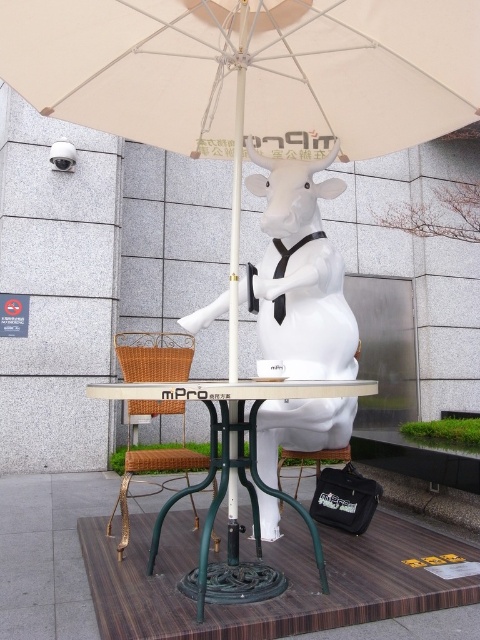
Between white glossy statue at center and green metal table at center, which one appears on the left side from the viewer's perspective?

Positioned to the left is green metal table at center.

Looking at this image, is white glossy statue at center taller than green metal table at center?

Indeed, white glossy statue at center has a greater height compared to green metal table at center.

At what (x,y) coordinates should I click in order to perform the action: click on white glossy statue at center. Please return your answer as a coordinate pair (x, y). The width and height of the screenshot is (480, 640). Looking at the image, I should click on (301, 273).

Which of these two, green metal table at center or woven rattan stool at lower center, stands taller?

green metal table at center is taller.

Does point (312, 392) come behind point (108, 522)?

That is False.

You are a GUI agent. You are given a task and a screenshot of the screen. Output one action in this format:
    pyautogui.click(x=<x>, y=<y>)
    Task: Click on the green metal table at center
    The height and width of the screenshot is (640, 480).
    Given the screenshot: What is the action you would take?
    pyautogui.click(x=231, y=401)

Does white glossy statue at center have a lesser width compared to woven rattan stool at lower center?

Incorrect, white glossy statue at center's width is not less than woven rattan stool at lower center's.

Who is higher up, white glossy statue at center or woven rattan stool at lower center?

Positioned higher is white glossy statue at center.

Who is more forward, [276,538] or [124,531]?

Point [124,531] is in front.

Identify the location of white glossy statue at center. The height and width of the screenshot is (640, 480). (301, 273).